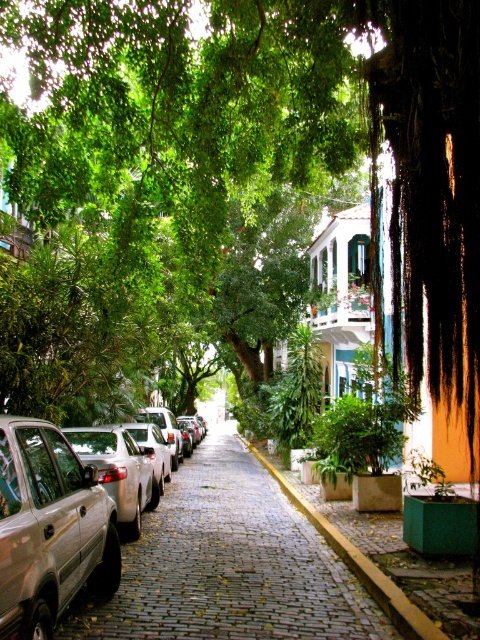
You are a delivery person trying to navigate a narrow cobblestone street. You need to deliver a package to the address located at the center of the street. According to the map, the cobblestone pavement at center is represented by point (239, 564). Can you safely drive your delivery van, which is 2 meters wide, through the narrowest part of the street?

The cobblestone pavement at center is represented by point (239, 564). However, there is no information provided about the width of the street or the narrowest part. Therefore, it is impossible to determine if the delivery van can safely pass through.

You are a delivery person standing at the entrance of the cobblestone street. Your delivery van is parked 5 meters behind you. You need to check if you can back the van up to the cobblestone pavement at center without hitting any obstacles. Can you do it?

The cobblestone pavement at center is 4.90 meters away from the camera. Since your van is parked 5 meters behind you, the distance between your van and the pavement is approximately 9.80 meters. Therefore, you have enough space to back up the van to the cobblestone pavement at center without hitting any obstacles.

You are standing on a cobblestone street with trees overhead and parked cars on the left. There are potted plants on the right. You see two points marked on the ground at coordinates point (218, 435) and point (22, 476). Which point is closer to you?

Point (218, 435) is further to the camera than point (22, 476), so the point closer to you is point (22, 476).